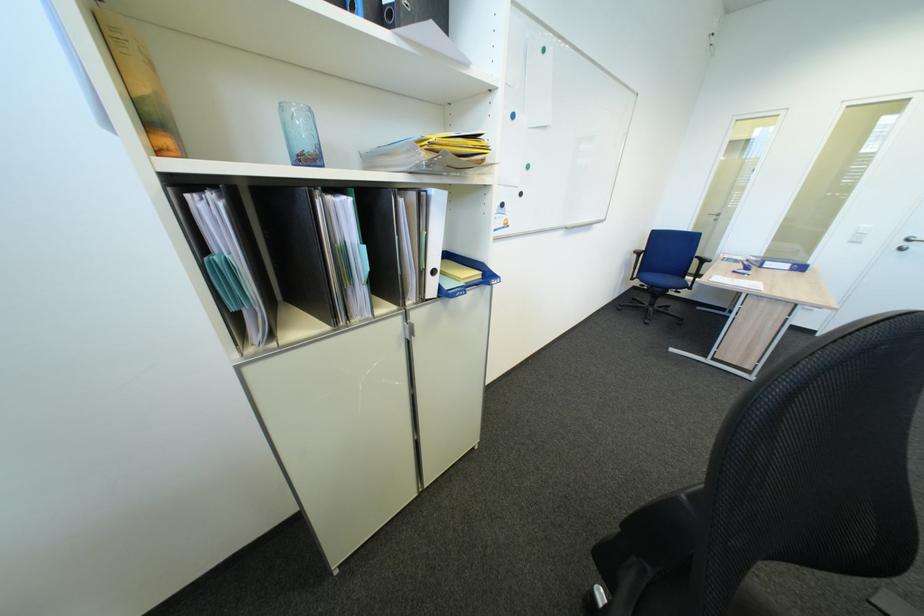
Find where to lift the yellow cover book. Please return your answer as a coordinate pair (x, y).

(458, 270)